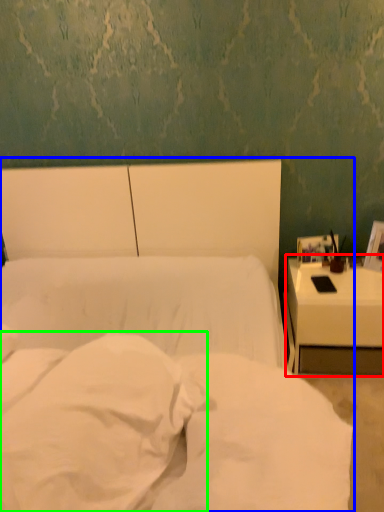
Question: Considering the real-world distances, which object is closest to nightstand (highlighted by a red box)? bed (highlighted by a blue box) or pillow (highlighted by a green box).

Choices:
 (A) bed
 (B) pillow

Answer: (A)